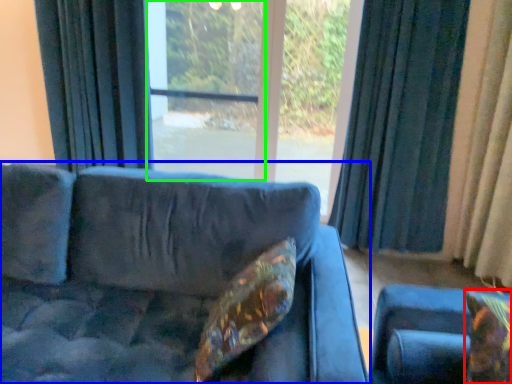
Question: Considering the real-world distances, which object is farthest from pillow (highlighted by a red box)? studio couch (highlighted by a blue box) or screen door (highlighted by a green box)?

Choices:
 (A) studio couch
 (B) screen door

Answer: (B)